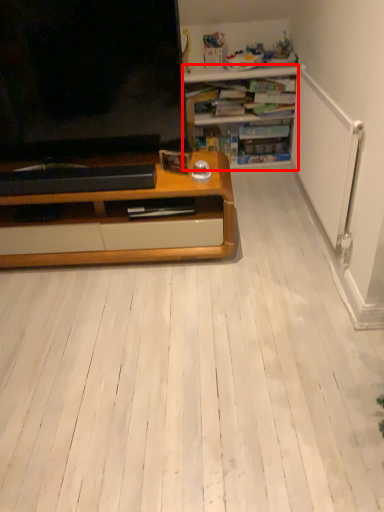
Question: From the image's perspective, where is desk (annotated by the red box) located in relation to television in the image?

Choices:
 (A) above
 (B) below

Answer: (A)